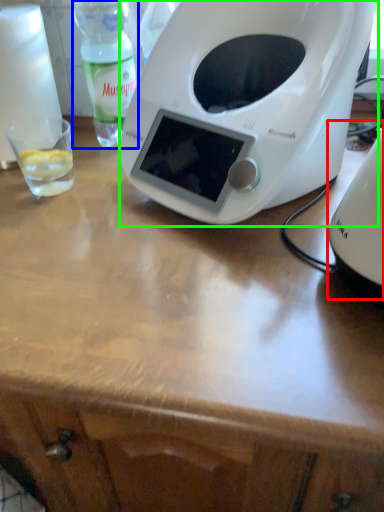
Question: Estimate the real-world distances between objects in this image. Which object is closer to appliance (highlighted by a red box), bottle (highlighted by a blue box) or toaster (highlighted by a green box)?

Choices:
 (A) bottle
 (B) toaster

Answer: (B)